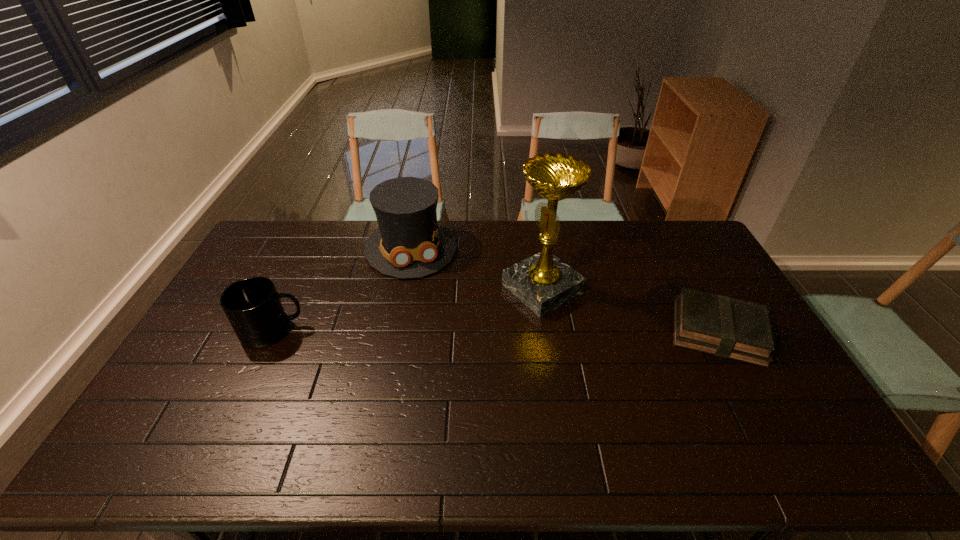
Locate an element on the screen. This screenshot has width=960, height=540. vacant space located 0.250m with goggles on the front of the third shortest object is located at coordinates (436, 330).

At what (x,y) coordinates should I click in order to perform the action: click on free region located with goggles on the front of the third shortest object. Please return your answer as a coordinate pair (x, y). The image size is (960, 540). Looking at the image, I should click on (438, 337).

Locate an element on the screen. The height and width of the screenshot is (540, 960). free location located with goggles on the front of the third shortest object is located at coordinates (443, 349).

Identify the location of free location located 0.300m on the front-facing side of the tallest object. (432, 347).

Find the location of `vacant space positioned 0.220m on the front-facing side of the tallest object`. vacant space positioned 0.220m on the front-facing side of the tallest object is located at coordinates (454, 335).

Image resolution: width=960 pixels, height=540 pixels. I want to click on vacant space located 0.340m on the front-facing side of the tallest object, so click(x=420, y=353).

This screenshot has height=540, width=960. I want to click on object located in the far edge section of the desktop, so click(409, 243).

Locate an element on the screen. The height and width of the screenshot is (540, 960). object situated at the left edge is located at coordinates (253, 307).

Where is `object that is at the right edge`? object that is at the right edge is located at coordinates (719, 325).

This screenshot has height=540, width=960. I want to click on vacant space at the far edge of the desktop, so click(x=328, y=221).